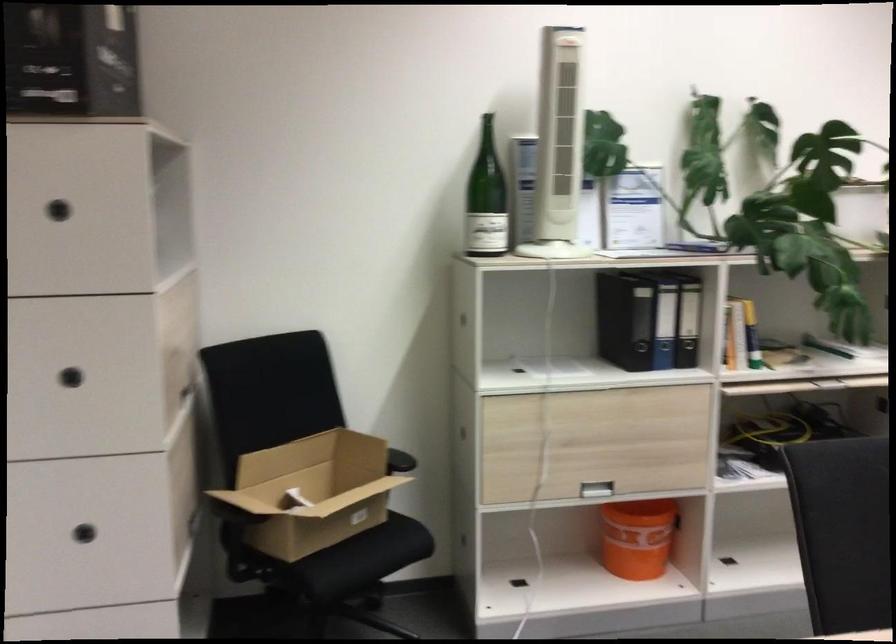
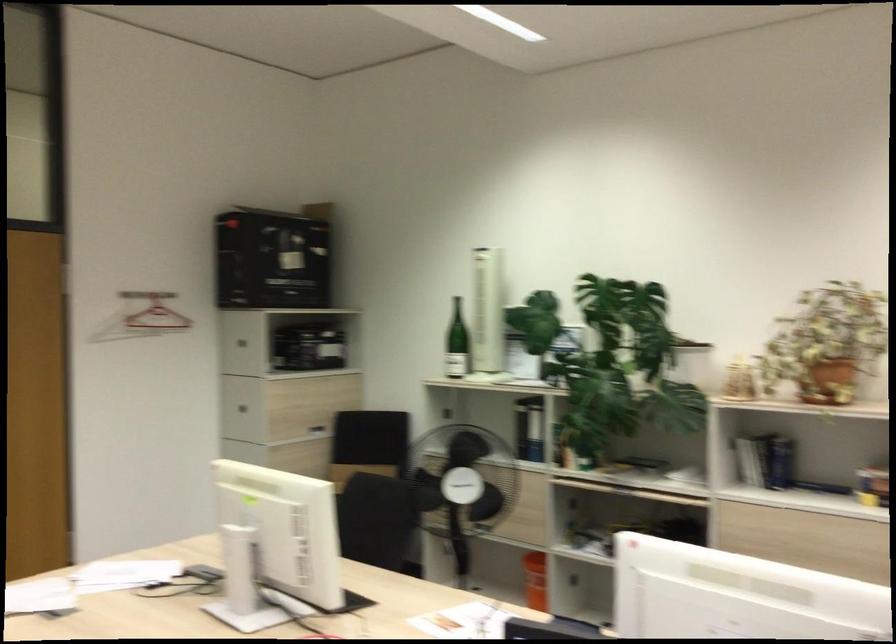
Question: I am providing you with two images of the same scene from different viewpoints. Please identify which objects are invisible in image2.

Choices:
 (A) red clothes hanger
 (B) chair sitting surface
 (C) orange bucket
 (D) metal stall latch

Answer: (B)